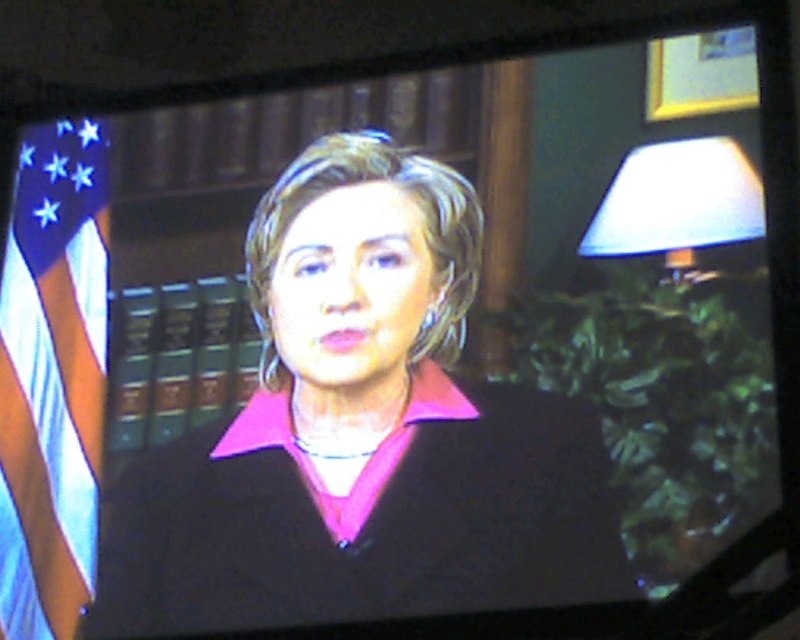
Does pink matte jacket at center have a lesser height compared to blue fabric flag at left?

Yes.

Between point (382, 378) and point (84, 531), which one is positioned behind?

Positioned behind is point (84, 531).

The height and width of the screenshot is (640, 800). What are the coordinates of `pink matte jacket at center` in the screenshot? It's located at (362, 435).

What do you see at coordinates (52, 380) in the screenshot? I see `blue fabric flag at left` at bounding box center [52, 380].

Find the location of a particular element. The image size is (800, 640). blue fabric flag at left is located at coordinates (52, 380).

What do you see at coordinates (362, 435) in the screenshot?
I see `pink matte jacket at center` at bounding box center [362, 435].

Is point (206, 577) positioned behind point (716, 273)?

Yes, point (206, 577) is farther from viewer.

Who is more distant from viewer, (505, 454) or (610, 209)?

The point (610, 209) is behind.

Where is `pink matte jacket at center`? Image resolution: width=800 pixels, height=640 pixels. pink matte jacket at center is located at coordinates (362, 435).